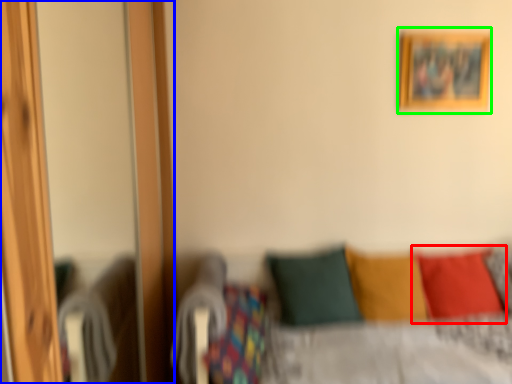
Question: Which object is the closest to the pillow (highlighted by a red box)? Choose among these: screen door (highlighted by a blue box) or picture frame (highlighted by a green box).

Choices:
 (A) screen door
 (B) picture frame

Answer: (B)